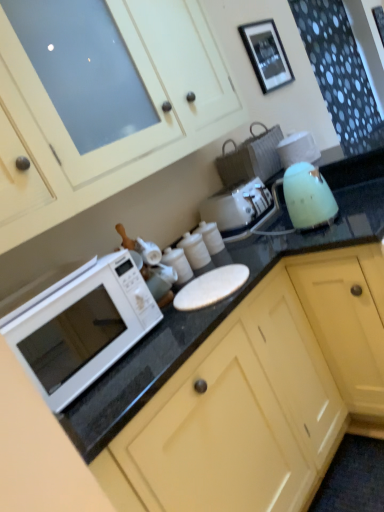
Find the location of a particular element. This screenshot has width=384, height=512. matte yellow cabinet at lower center, the second cabinetry positioned from the top is located at coordinates (262, 395).

What is the approximate width of matte white cabinet at upper center, the 1th cabinetry from the top?

41.62 centimeters.

Measure the distance between matte white cabinet at upper center, the 1th cabinetry from the top, and camera.

The depth of matte white cabinet at upper center, the 1th cabinetry from the top, is 3.59 feet.

In the scene shown: What is the approximate height of black matte picture frame at upper center?

The height of black matte picture frame at upper center is 17.25 inches.

Find the location of a particular element. matte yellow cabinet at lower center, the second cabinetry positioned from the top is located at coordinates (262, 395).

Based on their sizes in the image, would you say matte yellow cabinet at lower center, the second cabinetry positioned from the top, is bigger or smaller than matte white cabinet at upper center, the 1th cabinetry from the top?

In the image, matte yellow cabinet at lower center, the second cabinetry positioned from the top, appears to be larger than matte white cabinet at upper center, the 1th cabinetry from the top.

Can you confirm if matte yellow cabinet at lower center, the second cabinetry positioned from the top, is positioned to the left of matte white cabinet at upper center, the 1th cabinetry from the top?

Incorrect, matte yellow cabinet at lower center, the second cabinetry positioned from the top, is not on the left side of matte white cabinet at upper center, the 1th cabinetry from the top.

Which object is closer to the camera, matte yellow cabinet at lower center, the second cabinetry positioned from the top, or matte white cabinet at upper center, the 1th cabinetry from the top?

matte white cabinet at upper center, the 1th cabinetry from the top, is more forward.

Does point (44, 337) come farther from viewer compared to point (293, 80)?

No, (44, 337) is in front of (293, 80).

From a real-world perspective, which object stands above the other?

In real-world perspective, black matte picture frame at upper center is above.

Which of these two, white glossy microwave at left or black matte picture frame at upper center, is thinner?

With smaller width is black matte picture frame at upper center.

Between white glossy microwave at left and black matte picture frame at upper center, which one has smaller size?

black matte picture frame at upper center.

At what (x,y) coordinates should I click in order to perform the action: click on microwave oven above the matte yellow cabinet at lower center, the second cabinetry positioned from the top (from the image's perspective). Please return your answer as a coordinate pair (x, y). The height and width of the screenshot is (512, 384). Looking at the image, I should click on (83, 328).

From the image's perspective, which one is positioned higher, white glossy microwave at left or matte yellow cabinet at lower center, the second cabinetry positioned from the top?

white glossy microwave at left, from the image's perspective.

Is white glossy microwave at left aimed at matte yellow cabinet at lower center, which is the first cabinetry from bottom to top?

No, white glossy microwave at left is not aimed at matte yellow cabinet at lower center, which is the first cabinetry from bottom to top.

Which is behind, matte white cabinet at upper center, the 2th cabinetry positioned from the bottom, or black matte picture frame at upper center?

black matte picture frame at upper center.

Based on their sizes in the image, would you say matte white cabinet at upper center, the 2th cabinetry positioned from the bottom, is bigger or smaller than black matte picture frame at upper center?

matte white cabinet at upper center, the 2th cabinetry positioned from the bottom, is bigger than black matte picture frame at upper center.

What's the angular difference between matte white cabinet at upper center, the 2th cabinetry positioned from the bottom, and black matte picture frame at upper center's facing directions?

The angle between the facing direction of matte white cabinet at upper center, the 2th cabinetry positioned from the bottom, and the facing direction of black matte picture frame at upper center is 0.527 degrees.

Based on the photo, can we say matte white cabinet at upper center, the 1th cabinetry from the top, lies outside black matte picture frame at upper center?

Indeed, matte white cabinet at upper center, the 1th cabinetry from the top, is completely outside black matte picture frame at upper center.

The height and width of the screenshot is (512, 384). I want to click on picture frame above the matte yellow cabinet at lower center, which is the first cabinetry from bottom to top (from a real-world perspective), so click(x=266, y=54).

Is black matte picture frame at upper center oriented towards matte yellow cabinet at lower center, the second cabinetry positioned from the top?

No, black matte picture frame at upper center is not oriented towards matte yellow cabinet at lower center, the second cabinetry positioned from the top.

Considering the relative sizes of black matte picture frame at upper center and matte yellow cabinet at lower center, the second cabinetry positioned from the top, in the image provided, is black matte picture frame at upper center taller than matte yellow cabinet at lower center, the second cabinetry positioned from the top,?

Incorrect, the height of black matte picture frame at upper center is not larger of that of matte yellow cabinet at lower center, the second cabinetry positioned from the top.

Between black matte picture frame at upper center and matte yellow cabinet at lower center, which is the first cabinetry from bottom to top, which one has smaller width?

black matte picture frame at upper center is thinner.

Looking at their sizes, would you say matte white cabinet at upper center, the 2th cabinetry positioned from the bottom, is wider or thinner than white glossy microwave at left?

Considering their sizes, matte white cabinet at upper center, the 2th cabinetry positioned from the bottom, looks broader than white glossy microwave at left.

From the image's perspective, which one is positioned higher, matte white cabinet at upper center, the 2th cabinetry positioned from the bottom, or white glossy microwave at left?

From the image's view, matte white cabinet at upper center, the 2th cabinetry positioned from the bottom, is above.

Does matte white cabinet at upper center, the 1th cabinetry from the top, appear on the left side of white glossy microwave at left?

No.

Is black matte picture frame at upper center in front of or behind white glossy microwave at left in the image?

black matte picture frame at upper center is positioned farther from the viewer than white glossy microwave at left.

Is black matte picture frame at upper center located outside white glossy microwave at left?

Yes.

Who is bigger, black matte picture frame at upper center or white glossy microwave at left?

white glossy microwave at left is bigger.

Is black matte picture frame at upper center aimed at white glossy microwave at left?

No, black matte picture frame at upper center is not oriented towards white glossy microwave at left.

Image resolution: width=384 pixels, height=512 pixels. Identify the location of cabinetry behind the matte white cabinet at upper center, the 1th cabinetry from the top. (262, 395).

Find the location of `microwave oven that appears in front of the black matte picture frame at upper center`. microwave oven that appears in front of the black matte picture frame at upper center is located at coordinates (83, 328).

Considering their positions, is white glossy microwave at left positioned further to matte white cabinet at upper center, the 2th cabinetry positioned from the bottom, than matte yellow cabinet at lower center, which is the first cabinetry from bottom to top?

matte yellow cabinet at lower center, which is the first cabinetry from bottom to top, is further to matte white cabinet at upper center, the 2th cabinetry positioned from the bottom.

Which object lies further to the anchor point black matte picture frame at upper center, matte yellow cabinet at lower center, which is the first cabinetry from bottom to top, or white glossy microwave at left?

white glossy microwave at left is positioned further to the anchor black matte picture frame at upper center.

Based on their spatial positions, is white glossy microwave at left or matte yellow cabinet at lower center, the second cabinetry positioned from the top, closer to black matte picture frame at upper center?

matte yellow cabinet at lower center, the second cabinetry positioned from the top, lies closer to black matte picture frame at upper center than the other object.

Based on their spatial positions, is matte white cabinet at upper center, the 1th cabinetry from the top, or black matte picture frame at upper center closer to white glossy microwave at left?

matte white cabinet at upper center, the 1th cabinetry from the top, lies closer to white glossy microwave at left than the other object.

When comparing their distances from matte white cabinet at upper center, the 1th cabinetry from the top, does black matte picture frame at upper center or matte yellow cabinet at lower center, which is the first cabinetry from bottom to top, seem further?

black matte picture frame at upper center lies further to matte white cabinet at upper center, the 1th cabinetry from the top, than the other object.

From the image, which object appears to be farther from white glossy microwave at left, matte yellow cabinet at lower center, which is the first cabinetry from bottom to top, or black matte picture frame at upper center?

The object further to white glossy microwave at left is black matte picture frame at upper center.

Based on their spatial positions, is matte yellow cabinet at lower center, which is the first cabinetry from bottom to top, or black matte picture frame at upper center closer to matte white cabinet at upper center, the 1th cabinetry from the top?

matte yellow cabinet at lower center, which is the first cabinetry from bottom to top.

Based on their spatial positions, is matte white cabinet at upper center, the 1th cabinetry from the top, or white glossy microwave at left further from matte yellow cabinet at lower center, which is the first cabinetry from bottom to top?

The object further to matte yellow cabinet at lower center, which is the first cabinetry from bottom to top, is matte white cabinet at upper center, the 1th cabinetry from the top.

The height and width of the screenshot is (512, 384). In order to click on microwave oven between matte white cabinet at upper center, the 2th cabinetry positioned from the bottom, and matte yellow cabinet at lower center, which is the first cabinetry from bottom to top, in the vertical direction in this screenshot , I will do `click(83, 328)`.

What are the coordinates of `microwave oven between matte white cabinet at upper center, the 1th cabinetry from the top, and black matte picture frame at upper center, along the z-axis` in the screenshot? It's located at (83, 328).

Locate an element on the screen. This screenshot has height=512, width=384. microwave oven between black matte picture frame at upper center and matte yellow cabinet at lower center, which is the first cabinetry from bottom to top, from top to bottom is located at coordinates (83, 328).

Identify the location of cabinetry between matte white cabinet at upper center, the 1th cabinetry from the top, and black matte picture frame at upper center from front to back. (262, 395).